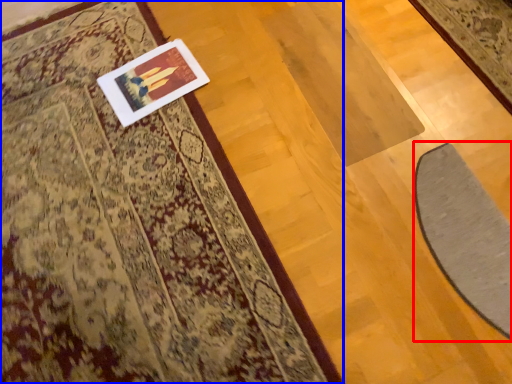
Question: Which of the following is the closest to the observer, doormat (highlighted by a red box) or mat (highlighted by a blue box)?

Choices:
 (A) doormat
 (B) mat

Answer: (B)